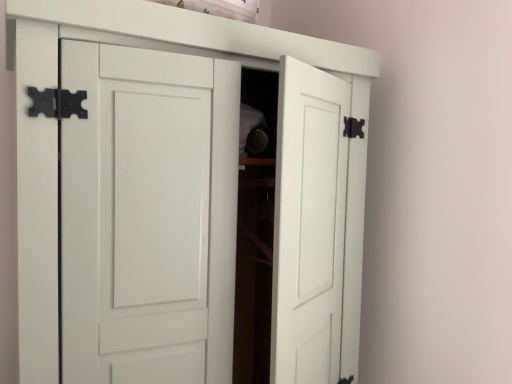
Question: Is white matte cupboard at center in front of or behind white matte shelf at upper center in the image?

Choices:
 (A) behind
 (B) front

Answer: (B)

Question: Considering the positions of white matte cupboard at center and white matte shelf at upper center in the image, is white matte cupboard at center bigger or smaller than white matte shelf at upper center?

Choices:
 (A) big
 (B) small

Answer: (A)

Question: From a real-world perspective, is white matte cupboard at center above or below white matte shelf at upper center?

Choices:
 (A) above
 (B) below

Answer: (B)

Question: In the image, is white matte shelf at upper center on the left side or the right side of white matte cupboard at center?

Choices:
 (A) left
 (B) right

Answer: (B)

Question: Does point (146, 6) appear closer or farther from the camera than point (8, 1)?

Choices:
 (A) farther
 (B) closer

Answer: (A)

Question: Considering the positions of white matte shelf at upper center and white matte cupboard at center in the image, is white matte shelf at upper center taller or shorter than white matte cupboard at center?

Choices:
 (A) short
 (B) tall

Answer: (A)

Question: Considering the positions of white matte shelf at upper center and white matte cupboard at center in the image, is white matte shelf at upper center bigger or smaller than white matte cupboard at center?

Choices:
 (A) big
 (B) small

Answer: (B)